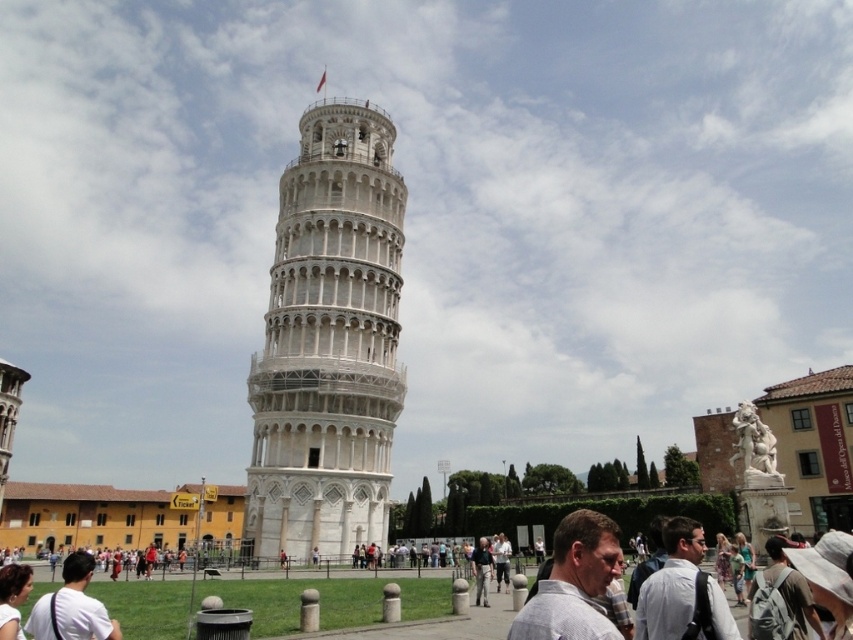
Question: Is white cotton shirt at lower left behind brown hair at lower left?

Choices:
 (A) yes
 (B) no

Answer: (A)

Question: Which object appears farthest from the camera in this image?

Choices:
 (A) white stone tower at center
 (B) light brown backpack at center

Answer: (A)

Question: Considering the real-world distances, which object is farthest from the white cotton shirt at lower right?

Choices:
 (A) brown hair at lower left
 (B) white stone tower at center
 (C) light brown backpack at lower right

Answer: (A)

Question: Which object appears farthest from the camera in this image?

Choices:
 (A) brown hair at lower left
 (B) dark blue jeans at center
 (C) white cotton shirt at lower left
 (D) white shirt at lower right

Answer: (B)

Question: Considering the relative positions of white marble tower at center and white stone tower at center in the image provided, where is white marble tower at center located with respect to white stone tower at center?

Choices:
 (A) above
 (B) below

Answer: (A)

Question: Considering the relative positions of dark blue jeans at center and floral dress at center in the image provided, where is dark blue jeans at center located with respect to floral dress at center?

Choices:
 (A) left
 (B) right

Answer: (A)